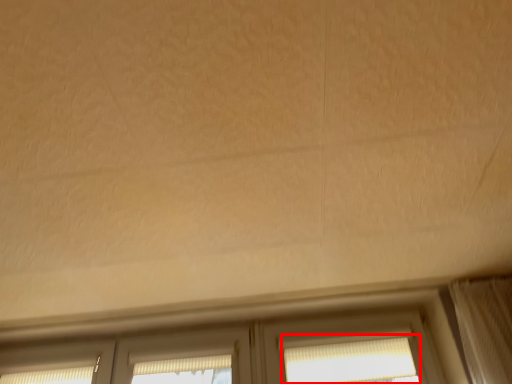
Question: Where is window (annotated by the red box) located in relation to screen door in the image?

Choices:
 (A) right
 (B) left

Answer: (A)